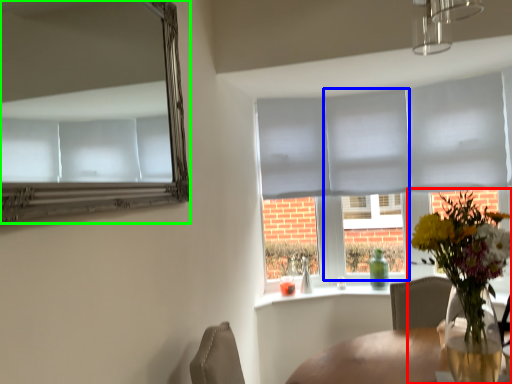
Question: Which object is the closest to the houseplant (highlighted by a red box)? Choose among these: glass door (highlighted by a blue box) or mirror (highlighted by a green box).

Choices:
 (A) glass door
 (B) mirror

Answer: (B)